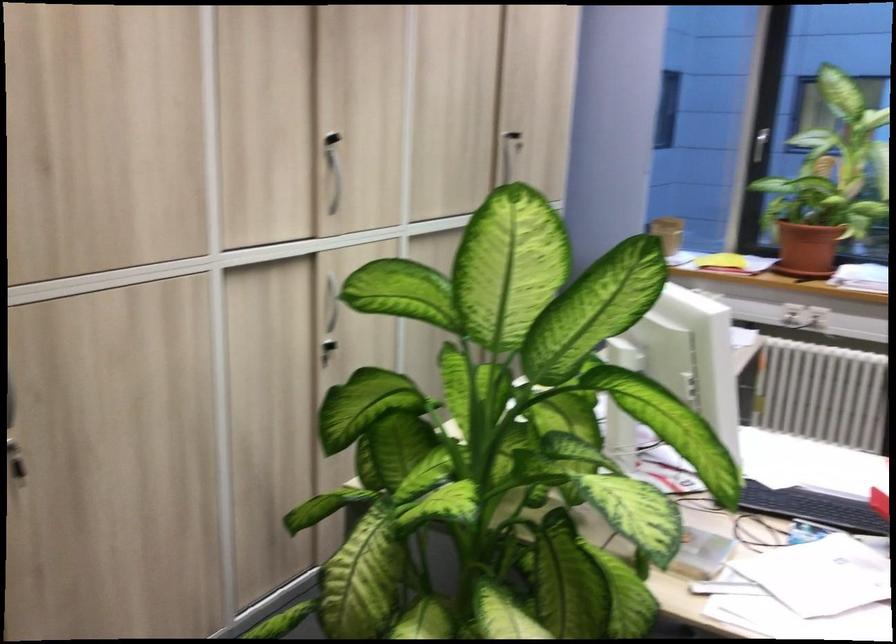
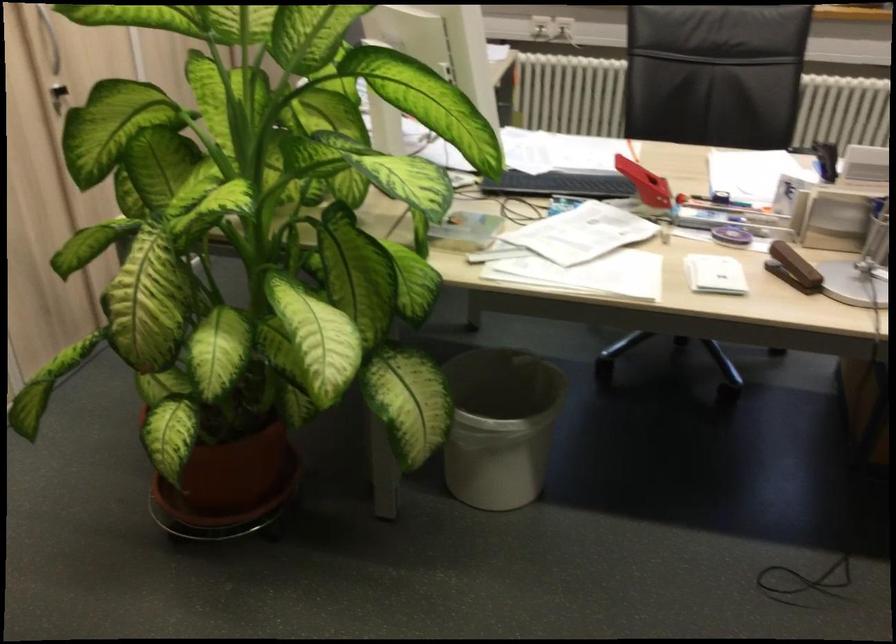
The point at (x=325, y=346) is marked in the first image. Where is the corresponding point in the second image?

(57, 96)